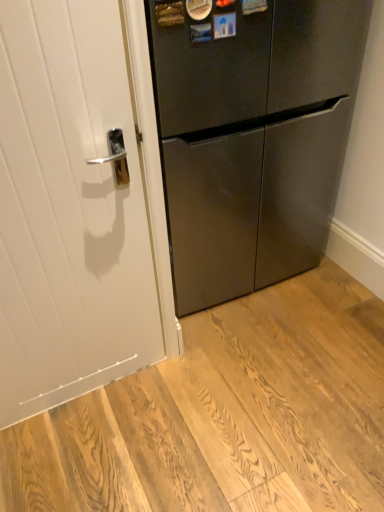
In order to face satin black refrigerator at center, should I rotate leftwards or rightwards?

To face it directly, rotate right by 4.240 degrees.

The height and width of the screenshot is (512, 384). Identify the location of satin black refrigerator at center. (252, 138).

This screenshot has width=384, height=512. What do you see at coordinates (252, 138) in the screenshot? I see `satin black refrigerator at center` at bounding box center [252, 138].

You are a GUI agent. You are given a task and a screenshot of the screen. Output one action in this format:
    pyautogui.click(x=<x>, y=<y>)
    Task: Click on the satin black refrigerator at center
    The width and height of the screenshot is (384, 512).
    Given the screenshot: What is the action you would take?
    pyautogui.click(x=252, y=138)